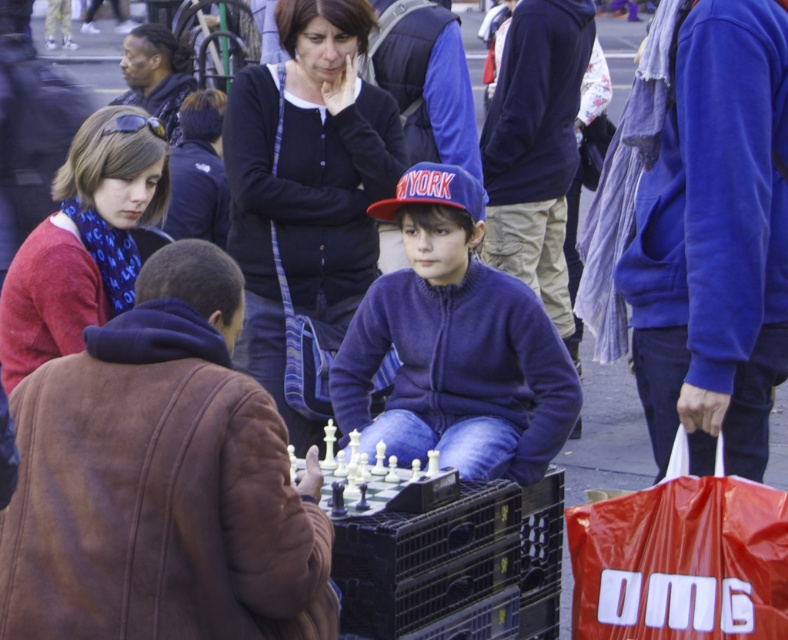
Does brown suede jacket at lower left lie in front of blue fleece jacket at center?

Yes.

Does brown suede jacket at lower left appear over blue fleece jacket at center?

No.

What do you see at coordinates (162, 481) in the screenshot? I see `brown suede jacket at lower left` at bounding box center [162, 481].

Find the location of a particular element. brown suede jacket at lower left is located at coordinates (162, 481).

Consider the image. Is red plastic bag at lower right bigger than matte red sweater at left?

Incorrect, red plastic bag at lower right is not larger than matte red sweater at left.

Which of these two, red plastic bag at lower right or matte red sweater at left, stands taller?

With more height is matte red sweater at left.

Is point (660, 561) less distant than point (93, 264)?

That is True.

Image resolution: width=788 pixels, height=640 pixels. Identify the location of red plastic bag at lower right. (681, 557).

Which is in front, point (32, 624) or point (764, 460)?

Point (32, 624) is in front.

Which is behind, point (217, 602) or point (756, 474)?

The point (756, 474) is behind.

Who is more distant from viewer, (95, 483) or (658, 429)?

Point (658, 429)

The width and height of the screenshot is (788, 640). What are the coordinates of `brown suede jacket at lower left` in the screenshot? It's located at click(162, 481).